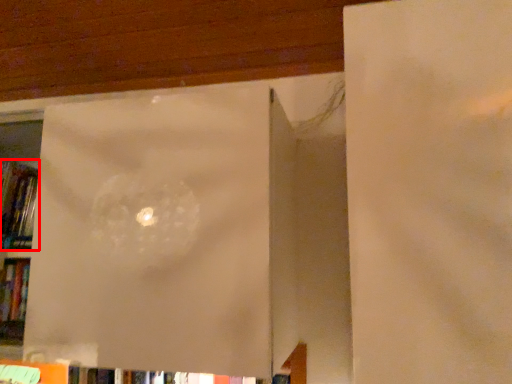
Question: From the image, what is the correct spatial relationship of book (annotated by the red box) in relation to window frame?

Choices:
 (A) left
 (B) right

Answer: (A)